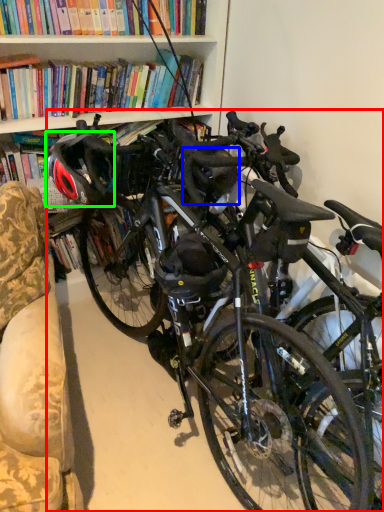
Question: Considering the real-world distances, which object is farthest from bicycle (highlighted by a red box)? helmet (highlighted by a blue box) or bicycle helmet (highlighted by a green box)?

Choices:
 (A) helmet
 (B) bicycle helmet

Answer: (B)